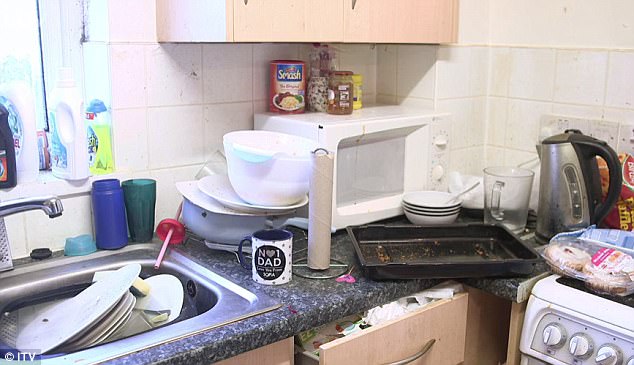
Image resolution: width=634 pixels, height=365 pixels. Identify the location of empty paper towel roll. (319, 211).